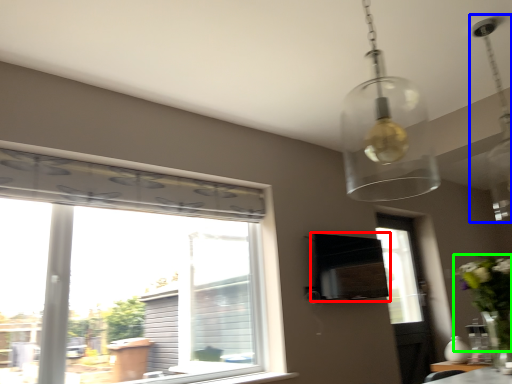
Question: Which object is the farthest from vent (highlighted by a red box)? Choose among these: light fixture (highlighted by a blue box) or floral arrangement (highlighted by a green box).

Choices:
 (A) light fixture
 (B) floral arrangement

Answer: (A)